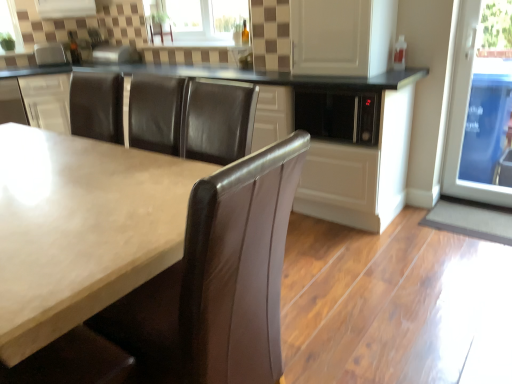
The width and height of the screenshot is (512, 384). Find the location of `free space above matte white countertop at center (from a real-world perspective)`. free space above matte white countertop at center (from a real-world perspective) is located at coordinates (71, 184).